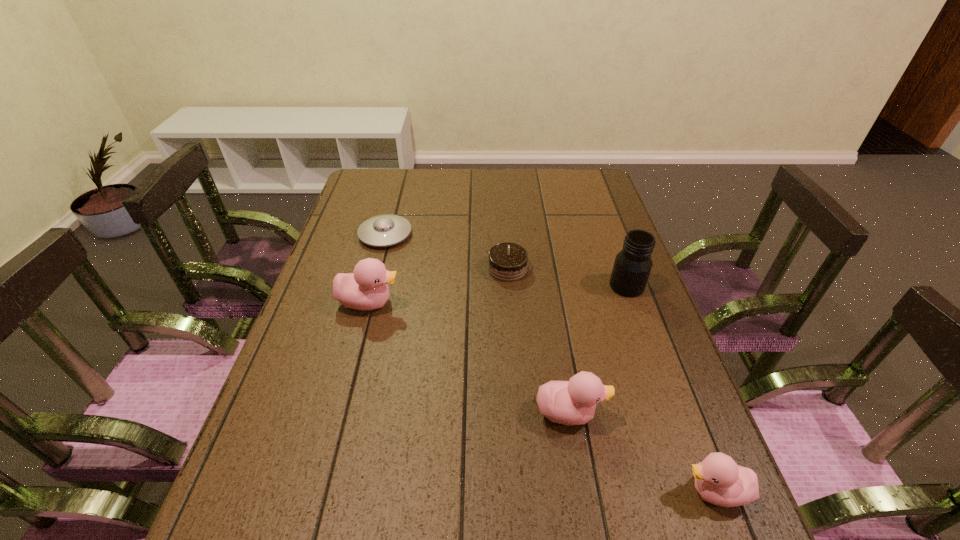
Image resolution: width=960 pixels, height=540 pixels. I want to click on free area in between the jar and the second shortest object, so tap(567, 278).

Where is `empty location between the second shortest object and the second tallest duckling`? This screenshot has width=960, height=540. empty location between the second shortest object and the second tallest duckling is located at coordinates (539, 341).

You are a GUI agent. You are given a task and a screenshot of the screen. Output one action in this format:
    pyautogui.click(x=<x>, y=<y>)
    Task: Click on the vacant space that is in between the nearest object and the saucer
    The width and height of the screenshot is (960, 540).
    Given the screenshot: What is the action you would take?
    pyautogui.click(x=550, y=363)

I want to click on object identified as the fifth closest to the third shortest object, so click(x=385, y=230).

Select which object is the fifth closest to the farthest duckling. Please provide its 2D coordinates. Your answer should be formatted as a tuple, i.e. [(x, y)], where the tuple contains the x and y coordinates of a point satisfying the conditions above.

[(719, 480)]

Identify the location of duckling that stands as the closest to the saucer. The width and height of the screenshot is (960, 540). (365, 289).

Select which duckling appears as the second closest to the fifth tallest object. Please provide its 2D coordinates. Your answer should be formatted as a tuple, i.e. [(x, y)], where the tuple contains the x and y coordinates of a point satisfying the conditions above.

[(573, 402)]

Find the location of a particular element. Image resolution: width=960 pixels, height=540 pixels. free location that satisfies the following two spatial constraints: 1. on the front side of the jar; 2. on the front-facing side of the farthest duckling is located at coordinates (633, 302).